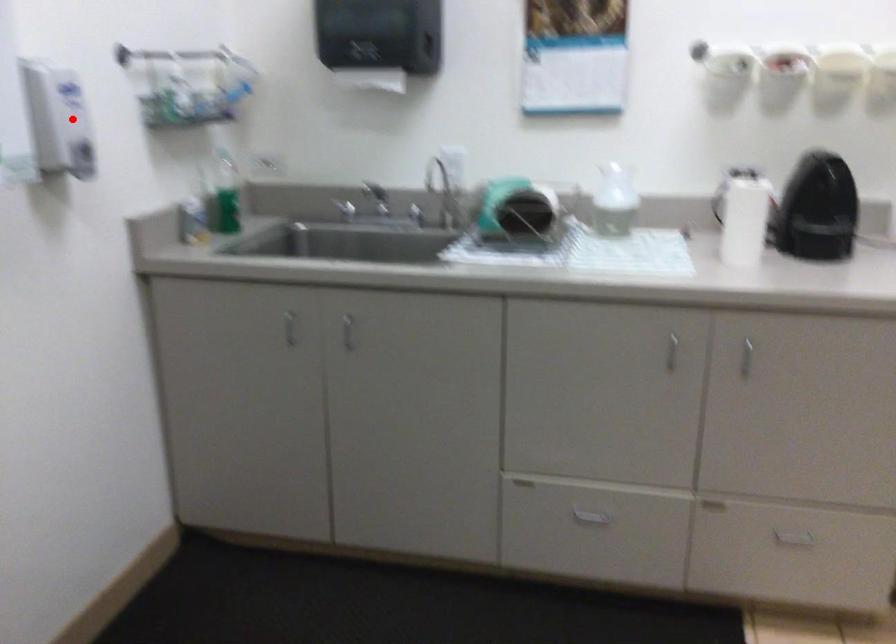
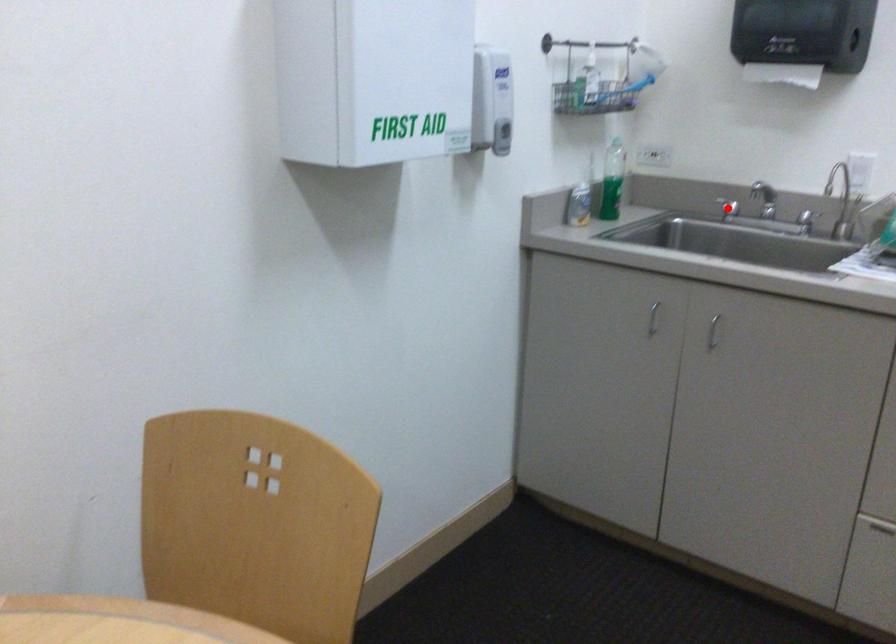
I am providing you with two images of the same scene from different viewpoints. A red point is marked on the first image and another point is marked on the second image. Does the point marked in image1 correspond to the same location as the one in image2?

No